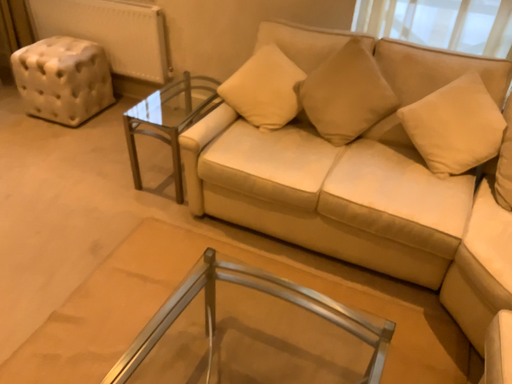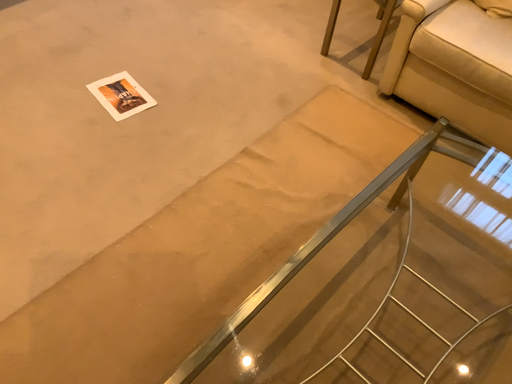
Question: How did the camera likely rotate when shooting the video?

Choices:
 (A) rotated left
 (B) rotated right

Answer: (A)